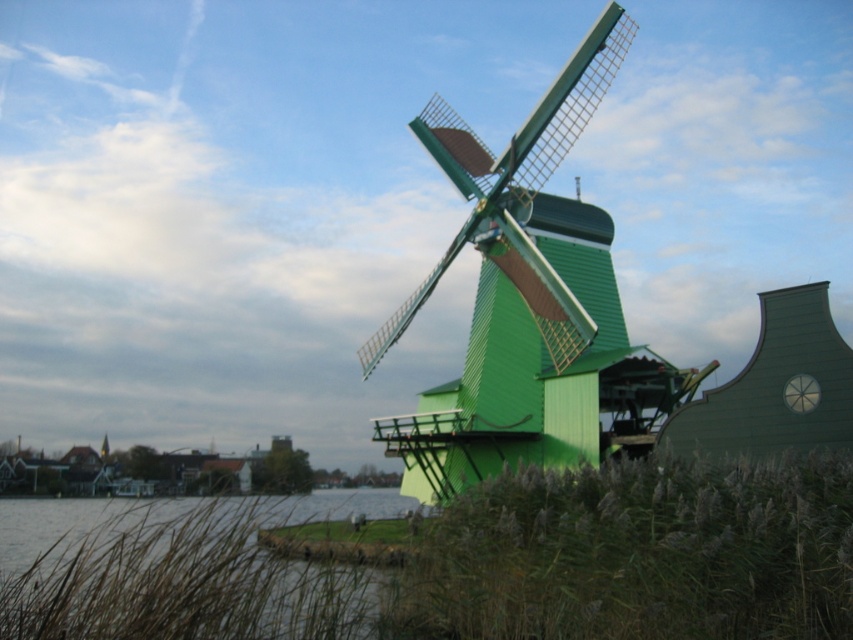
Is point (495, 580) less distant than point (498, 184)?

Yes, it is.

Between point (701, 624) and point (619, 19), which one is positioned in front?

Point (701, 624)

Image resolution: width=853 pixels, height=640 pixels. Identify the location of green grass at lower right. (637, 554).

Does green grass at lower right have a greater height compared to clear water at lower left?

No.

Does green grass at lower right have a smaller size compared to clear water at lower left?

Yes, green grass at lower right is smaller than clear water at lower left.

Does point (633, 561) lie in front of point (341, 516)?

Yes.

Identify the location of green grass at lower right. This screenshot has height=640, width=853. (637, 554).

Does clear water at lower left have a greater height compared to green wooden windmill at center?

No, clear water at lower left is not taller than green wooden windmill at center.

Based on the photo, does clear water at lower left come behind green wooden windmill at center?

No, clear water at lower left is in front of green wooden windmill at center.

Between point (128, 534) and point (527, 154), which one is positioned behind?

The point (527, 154) is more distant.

The height and width of the screenshot is (640, 853). In order to click on clear water at lower left in this screenshot , I will do `click(173, 570)`.